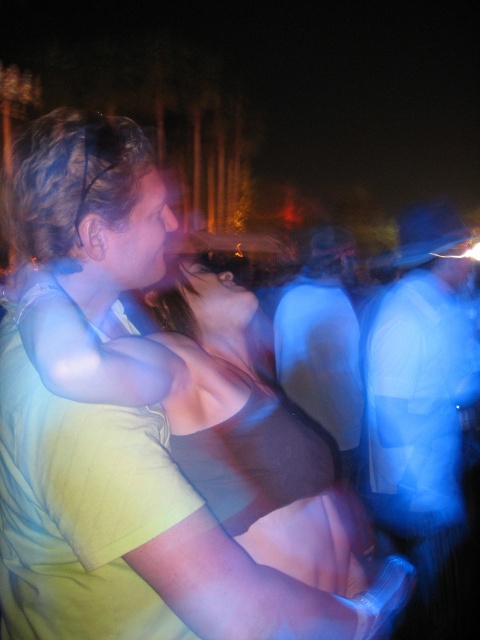
Question: Which point is closer to the camera?

Choices:
 (A) matte black shirt at center
 (B) blue fabric shirt at right
 (C) matte black tank top at center

Answer: (C)

Question: Based on their relative distances, which object is nearer to the blue fabric shirt at right?

Choices:
 (A) matte black shirt at center
 (B) matte black tank top at center

Answer: (A)

Question: Which point is farther to the camera?

Choices:
 (A) (205, 378)
 (B) (450, 582)
 (C) (347, 236)

Answer: (C)

Question: Does matte black tank top at center appear on the right side of matte black shirt at center?

Choices:
 (A) no
 (B) yes

Answer: (A)

Question: Is matte black tank top at center to the right of blue fabric shirt at right from the viewer's perspective?

Choices:
 (A) no
 (B) yes

Answer: (A)

Question: Can you confirm if matte black tank top at center is wider than blue fabric shirt at right?

Choices:
 (A) yes
 (B) no

Answer: (B)